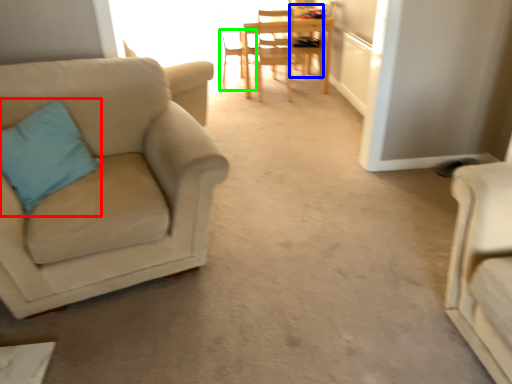
Question: Which object is positioned closest to pillow (highlighted by a red box)? Select from chair (highlighted by a blue box) and chair (highlighted by a green box).

Choices:
 (A) chair
 (B) chair

Answer: (B)